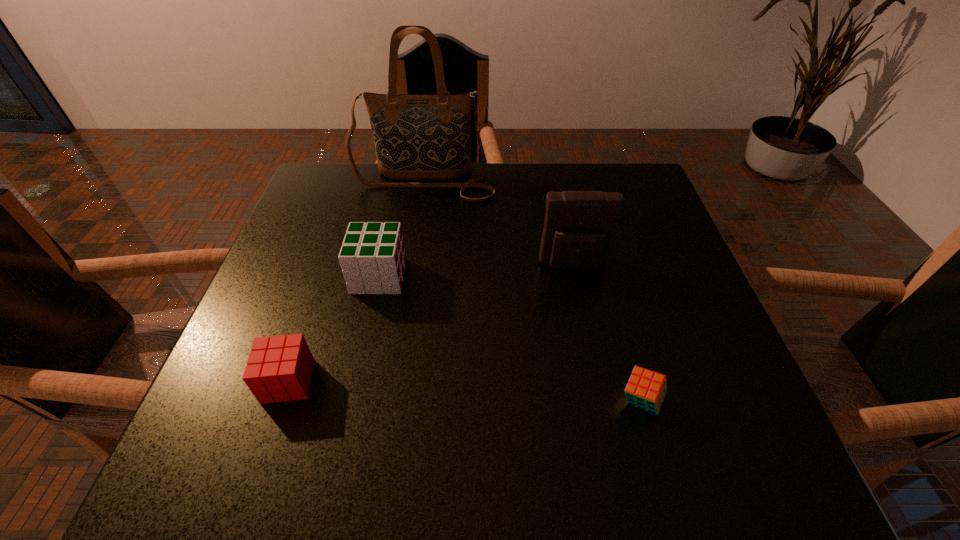
This screenshot has height=540, width=960. I want to click on vacant space that's between the rightmost cube and the fourth shortest object, so click(x=607, y=333).

The width and height of the screenshot is (960, 540). What are the coordinates of `empty space between the rightmost cube and the pouch` in the screenshot? It's located at (607, 333).

Identify the location of object that stands as the second closest to the leftmost cube. This screenshot has height=540, width=960. (579, 227).

Identify which object is the fourth nearest to the handbag. Please provide its 2D coordinates. Your answer should be formatted as a tuple, i.e. [(x, y)], where the tuple contains the x and y coordinates of a point satisfying the conditions above.

[(646, 389)]

What are the coordinates of `cube that is the closest to the tallest object` in the screenshot? It's located at (372, 256).

Identify which cube is the third closest to the pouch. Please provide its 2D coordinates. Your answer should be formatted as a tuple, i.e. [(x, y)], where the tuple contains the x and y coordinates of a point satisfying the conditions above.

[(279, 368)]

The width and height of the screenshot is (960, 540). Identify the location of vacant region that satisfies the following two spatial constraints: 1. on the front-facing side of the rightmost cube; 2. on the right side of the handbag. (389, 401).

What are the coordinates of `free region that satisfies the following two spatial constraints: 1. on the red face of the second cube from left to right; 2. on the left side of the rightmost cube` in the screenshot? It's located at (351, 401).

You are a GUI agent. You are given a task and a screenshot of the screen. Output one action in this format:
    pyautogui.click(x=<x>, y=<y>)
    Task: Click on the vacant space that satisfies the following two spatial constraints: 1. with an open flap on the second tallest object; 2. on the red face of the third shortest object
    Image resolution: width=960 pixels, height=540 pixels.
    Given the screenshot: What is the action you would take?
    pyautogui.click(x=576, y=276)

Identify the location of free location that satisfies the following two spatial constraints: 1. on the front-facing side of the rightmost cube; 2. on the left side of the farthest object. (389, 401).